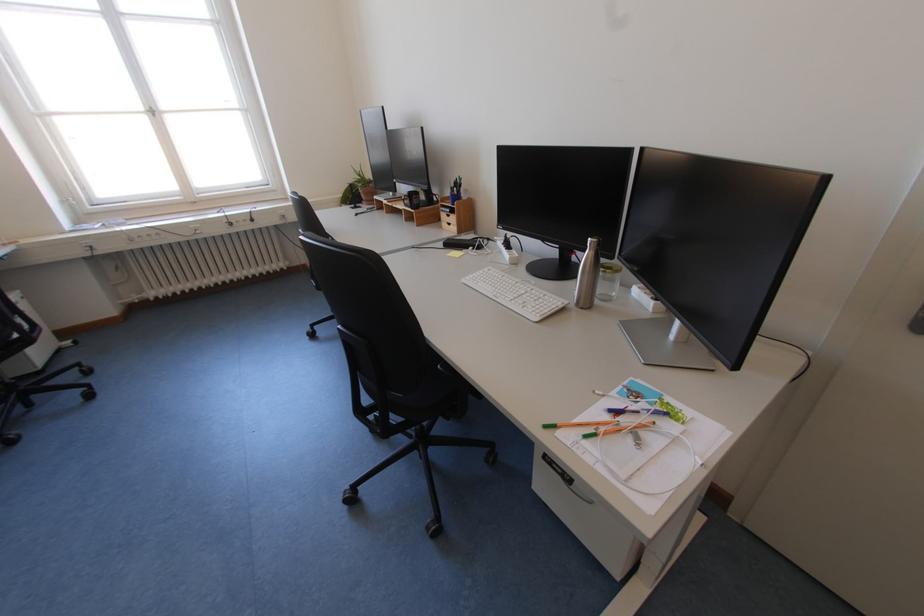
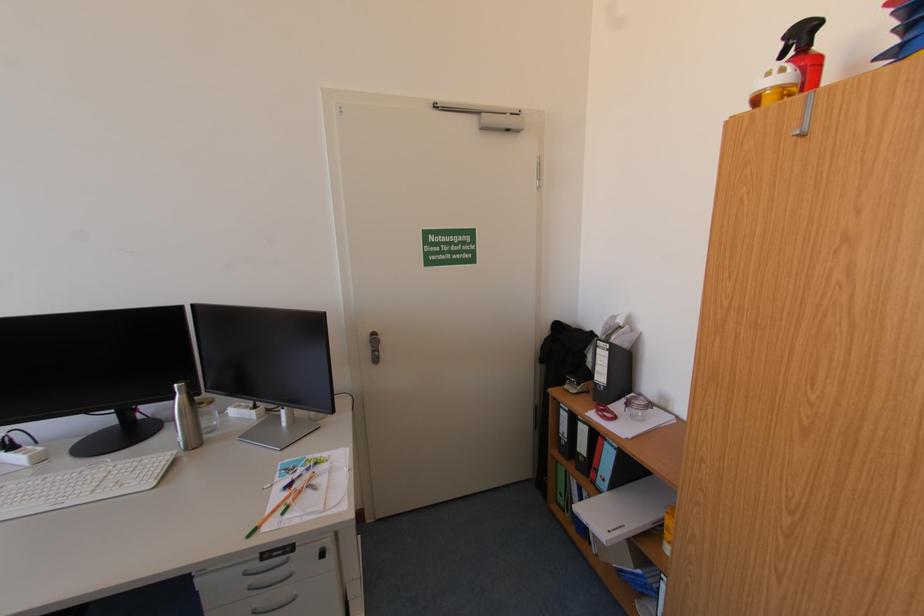
Question: Based on the continuous images, in which direction is the camera rotating? Reply with the corresponding letter.

Choices:
 (A) Left
 (B) Right
 (C) Up
 (D) Down

Answer: (B)